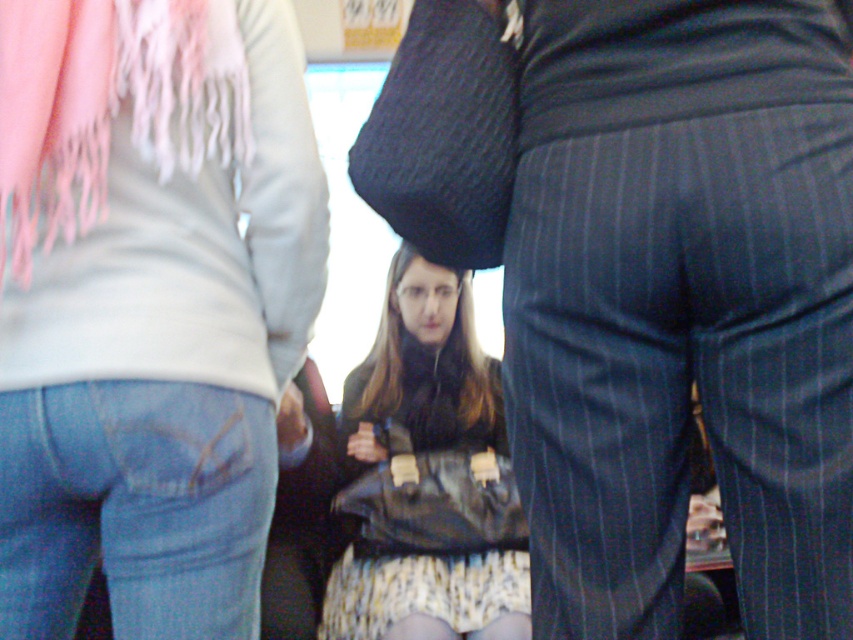
Question: Can you confirm if pink fringed scarf at upper left is smaller than leather bag at center?

Choices:
 (A) yes
 (B) no

Answer: (A)

Question: Which point is farther from the camera taking this photo?

Choices:
 (A) (459, 349)
 (B) (48, 112)

Answer: (A)

Question: Can you confirm if pink fringed scarf at upper left is positioned to the left of leather bag at center?

Choices:
 (A) no
 (B) yes

Answer: (B)

Question: Is pink fringed scarf at upper left below leather bag at center?

Choices:
 (A) yes
 (B) no

Answer: (B)